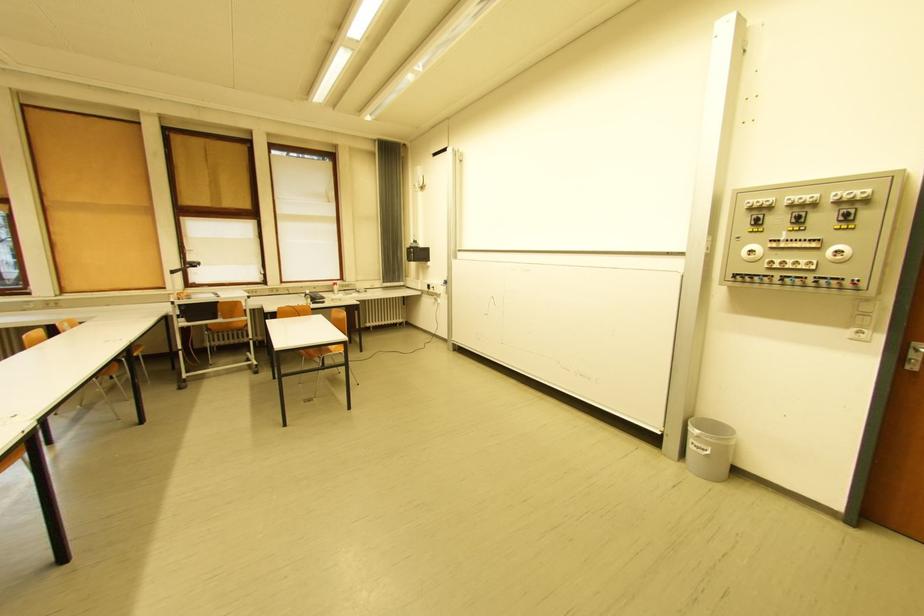
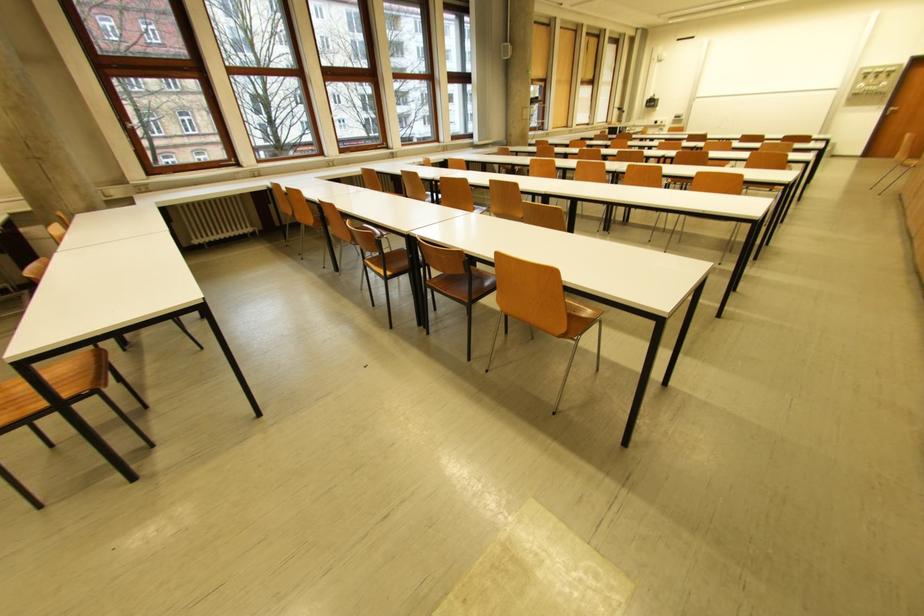
The point at [886,339] is marked in the first image. Where is the corresponding point in the second image?

(891, 108)